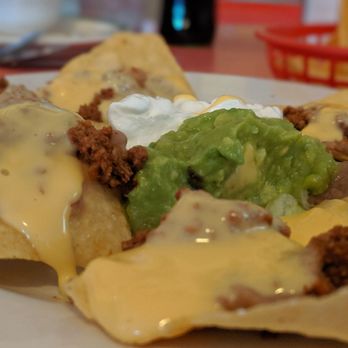
In order to click on plate in background in this screenshot , I will do `click(61, 38)`.